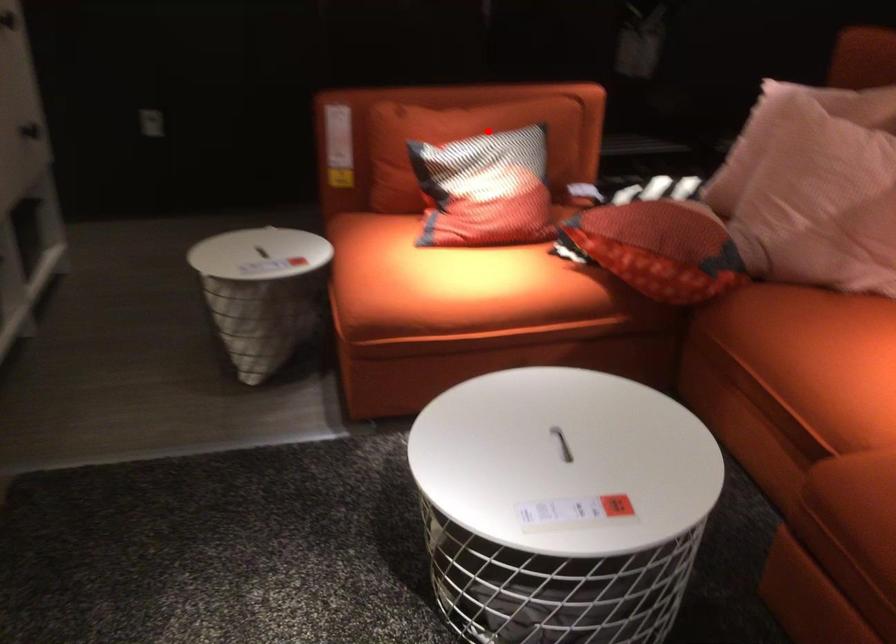
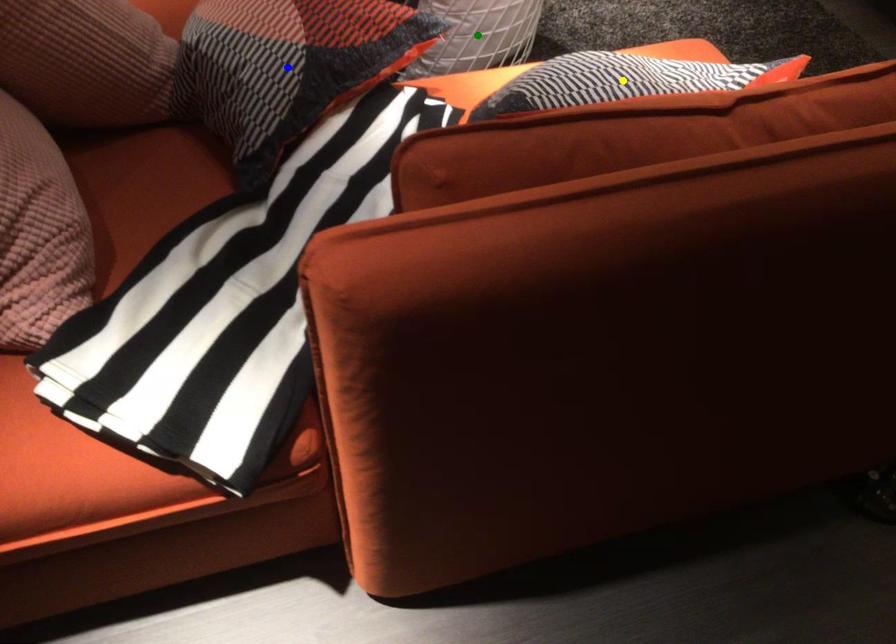
Question: I am providing you with two images of the same scene from different viewpoints. A red point is marked on the first image. You are given multiple points on the second image. In image 2, which mark is for the same physical point as the one in image 1?

Choices:
 (A) yellow point
 (B) green point
 (C) blue point

Answer: (A)